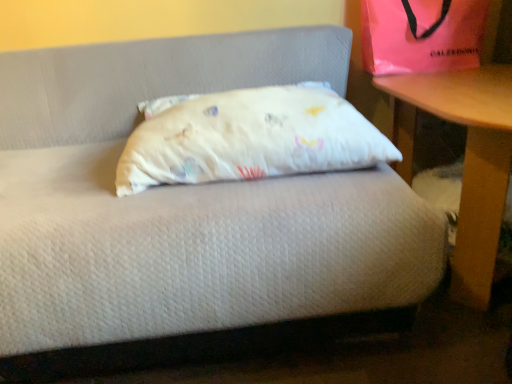
At what (x,y) coordinates should I click in order to perform the action: click on wooden table at right. Please return your answer as a coordinate pair (x, y). Looking at the image, I should click on (464, 160).

Based on the photo, is white cotton pillow at center inside or outside of pink satin bag at upper right?

white cotton pillow at center is not inside pink satin bag at upper right, it's outside.

From the image's perspective, is white cotton pillow at center on pink satin bag at upper right?

No, from the image's perspective, white cotton pillow at center is not over pink satin bag at upper right.

Which point is more forward, [121,194] or [400,6]?

The point [121,194] is more forward.

Is the position of white cotton pillow at center more distant than that of pink satin bag at upper right?

No, white cotton pillow at center is closer to the camera.

Who is shorter, white cotton pillow at center or wooden table at right?

white cotton pillow at center is shorter.

From a real-world perspective, which is physically below, white cotton pillow at center or wooden table at right?

In real-world perspective, wooden table at right is lower.

Can you confirm if wooden table at right is positioned to the left of pink satin bag at upper right?

No, wooden table at right is not to the left of pink satin bag at upper right.

The image size is (512, 384). In order to click on table beneath the pink satin bag at upper right (from a real-world perspective) in this screenshot , I will do `click(464, 160)`.

Are wooden table at right and pink satin bag at upper right far apart?

wooden table at right is actually quite close to pink satin bag at upper right.

Who is taller, pink satin bag at upper right or wooden table at right?

wooden table at right is taller.

Is pink satin bag at upper right facing towards wooden table at right?

No, pink satin bag at upper right does not turn towards wooden table at right.

Is pink satin bag at upper right in front of or behind wooden table at right in the image?

pink satin bag at upper right is positioned farther from the viewer than wooden table at right.

Where is `table on the right of the pink satin bag at upper right`? The height and width of the screenshot is (384, 512). table on the right of the pink satin bag at upper right is located at coordinates (464, 160).

Is pink satin bag at upper right turned away from white cotton pillow at center?

No, pink satin bag at upper right is not facing away from white cotton pillow at center.

Is pink satin bag at upper right next to white cotton pillow at center?

There is a gap between pink satin bag at upper right and white cotton pillow at center.

Between pink satin bag at upper right and white cotton pillow at center, which one appears on the left side from the viewer's perspective?

Positioned to the left is white cotton pillow at center.

Can you tell me how much pink satin bag at upper right and white cotton pillow at center differ in facing direction?

The facing directions of pink satin bag at upper right and white cotton pillow at center are 1.64 degrees apart.

Considering the sizes of wooden table at right and white cotton pillow at center in the image, is wooden table at right taller or shorter than white cotton pillow at center?

Clearly, wooden table at right is taller compared to white cotton pillow at center.

Can you confirm if wooden table at right is wider than white cotton pillow at center?

Yes.

Can you tell me how much wooden table at right and white cotton pillow at center differ in facing direction?

There is a 87.3-degree angle between the facing directions of wooden table at right and white cotton pillow at center.

Is wooden table at right aimed at white cotton pillow at center?

Yes, wooden table at right is aimed at white cotton pillow at center.

At what (x,y) coordinates should I click in order to perform the action: click on pillow on the left side of pink satin bag at upper right. Please return your answer as a coordinate pair (x, y). The width and height of the screenshot is (512, 384). Looking at the image, I should click on (248, 137).

At what (x,y) coordinates should I click in order to perform the action: click on table on the right of white cotton pillow at center. Please return your answer as a coordinate pair (x, y). The height and width of the screenshot is (384, 512). Looking at the image, I should click on (464, 160).

Estimate the real-world distances between objects in this image. Which object is further from white cotton pillow at center, wooden table at right or pink satin bag at upper right?

Result: pink satin bag at upper right lies further to white cotton pillow at center than the other object.

Looking at the image, which one is located further to pink satin bag at upper right, wooden table at right or white cotton pillow at center?

Based on the image, white cotton pillow at center appears to be further to pink satin bag at upper right.

Considering their positions, is pink satin bag at upper right positioned closer to wooden table at right than white cotton pillow at center?

pink satin bag at upper right.

Considering their positions, is white cotton pillow at center positioned closer to wooden table at right than pink satin bag at upper right?

Among the two, pink satin bag at upper right is located nearer to wooden table at right.

Considering their positions, is pink satin bag at upper right positioned closer to white cotton pillow at center than wooden table at right?

wooden table at right.

When comparing their distances from pink satin bag at upper right, does white cotton pillow at center or wooden table at right seem further?

white cotton pillow at center is positioned further to the anchor pink satin bag at upper right.

You are a GUI agent. You are given a task and a screenshot of the screen. Output one action in this format:
    pyautogui.click(x=<x>, y=<y>)
    Task: Click on the bean bag chair situated between white cotton pillow at center and wooden table at right from left to right
    The height and width of the screenshot is (384, 512).
    Given the screenshot: What is the action you would take?
    pyautogui.click(x=421, y=35)